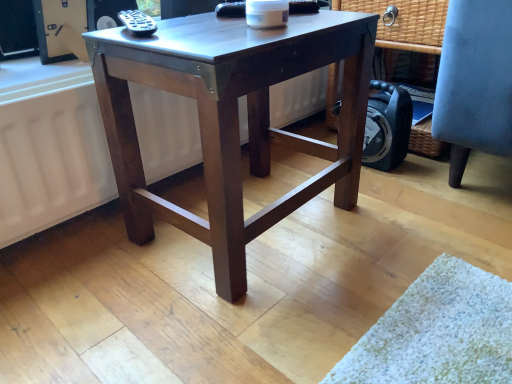
Find the location of a particular element. The width and height of the screenshot is (512, 384). vacant space to the left of dark wood table at center is located at coordinates (95, 259).